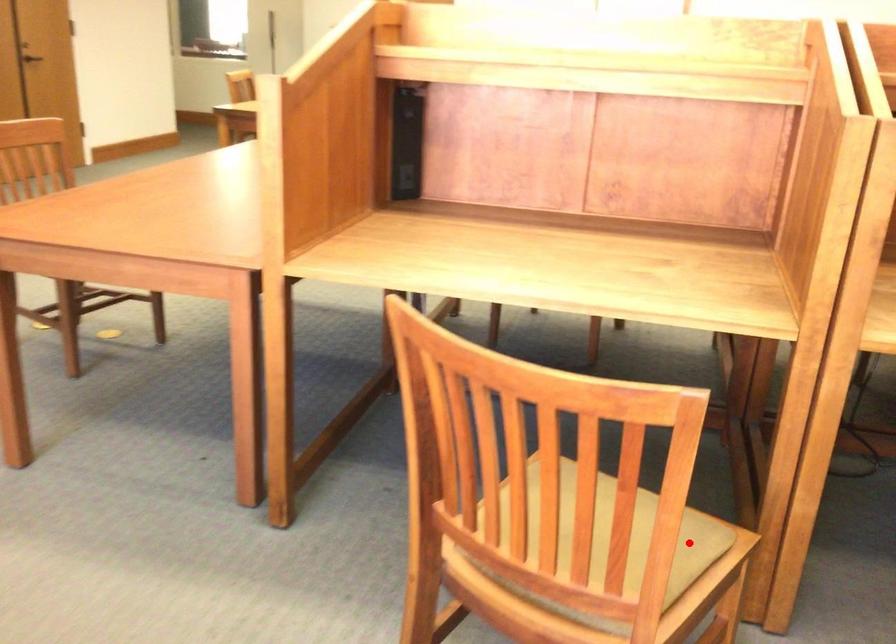
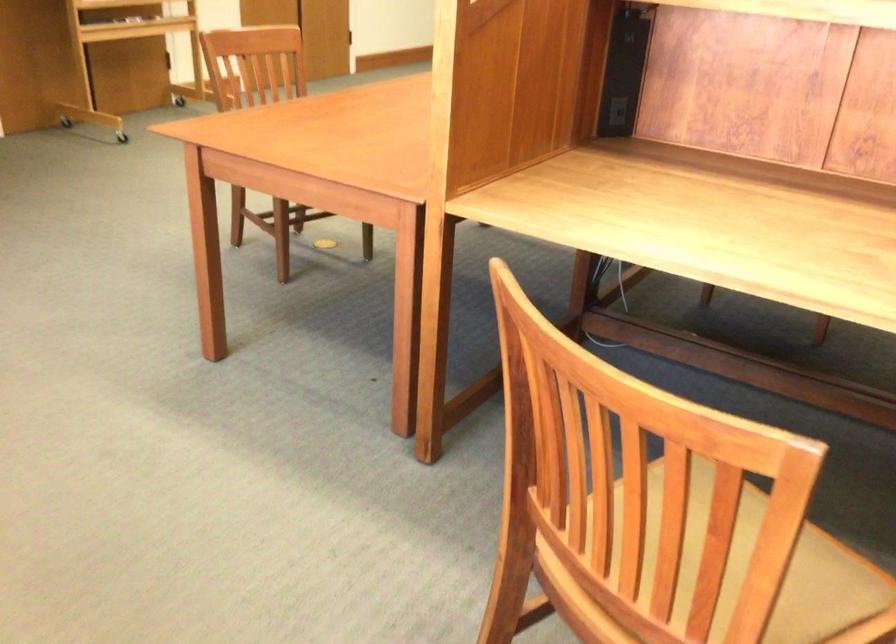
Question: A red point is marked in image1. In image2, is the corresponding 3D point closer to the camera or farther? Reply with the corresponding letter.

Choices:
 (A) The corresponding 3D point is closer.
 (B) The corresponding 3D point is farther.

Answer: (A)